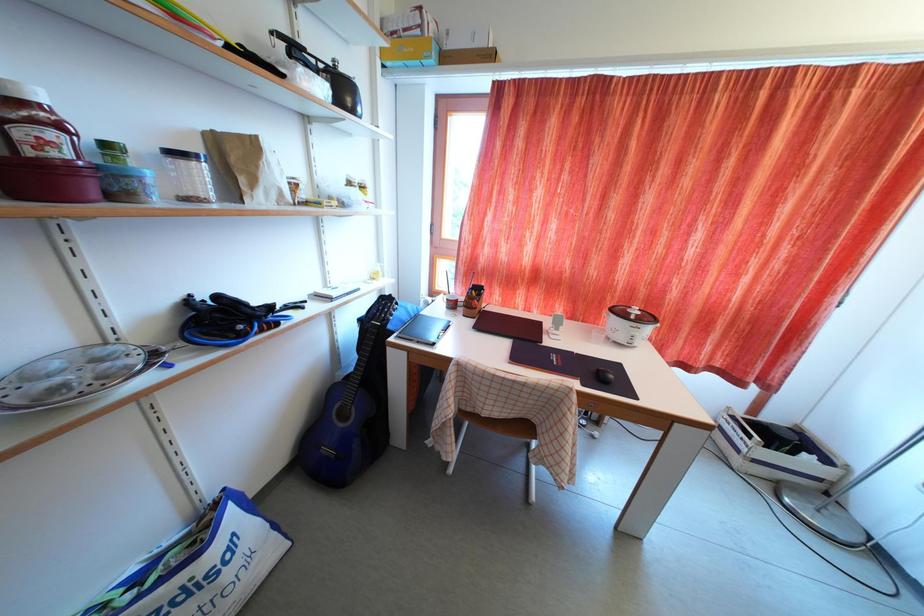
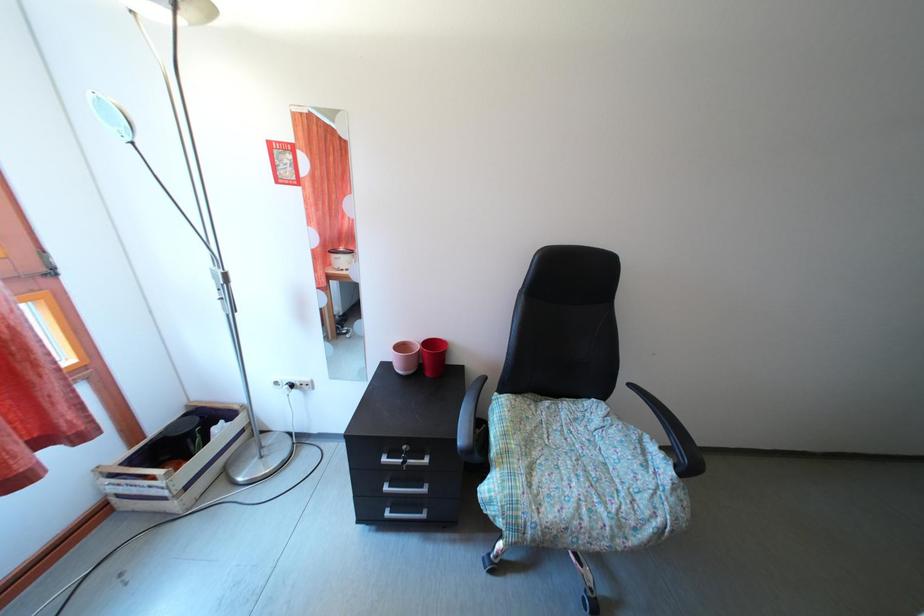
From the picture: First-person continuous shooting, in which direction is the camera rotating?

The rotation direction of the camera is right-down.